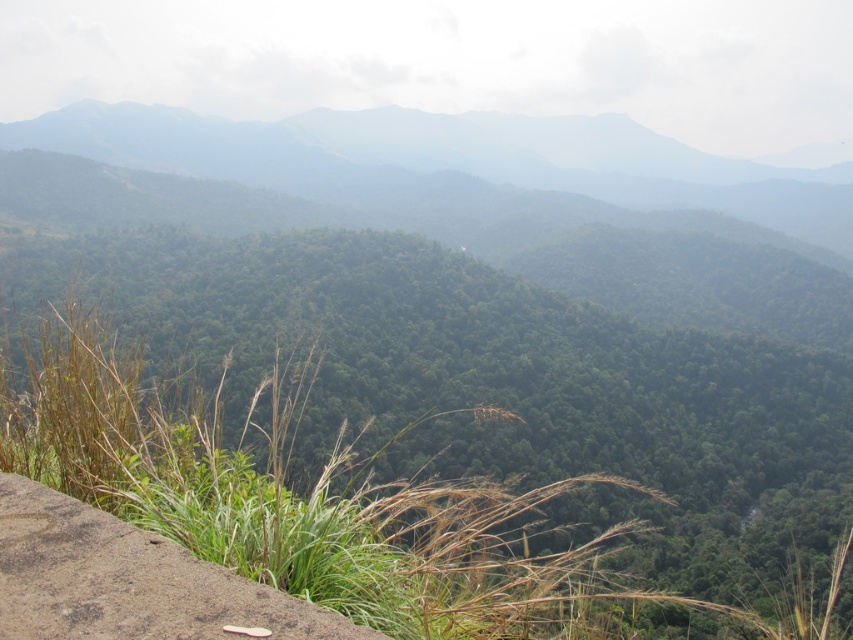
You are a hiker who wants to cross the brown rough stone ledge at lower left but need to avoid the green leafy grass at lower left. Which direction should you move relative to the grass to reach the stone ledge?

The green leafy grass at lower left is on the left side of the brown rough stone ledge at lower left. To avoid the grass and reach the stone ledge, move to the right side of the green leafy grass at lower left.

You are a hiker standing at the edge of the forest. You notice the green leafy grass at lower left and the brown rough stone ledge at lower left. Which object is closer to you as you look towards the forest?

The green leafy grass at lower left is closer to you because the brown rough stone ledge at lower left is positioned behind it.

You are standing in the forest looking at the image. There is a point marked at coordinates (495, 381). What is located at that point?

The point at coordinates (495, 381) indicates green leafy grass at lower left.